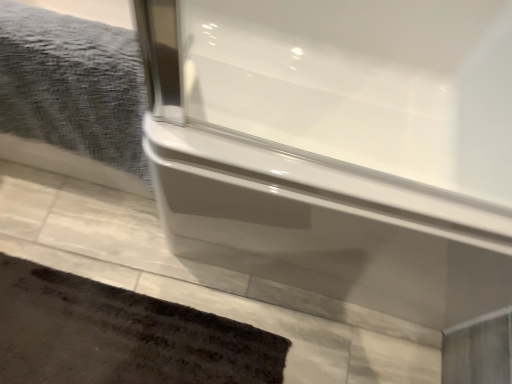
The image size is (512, 384). Find the location of `free space to the back side of dark brown textured bath mat at lower left`. free space to the back side of dark brown textured bath mat at lower left is located at coordinates (135, 247).